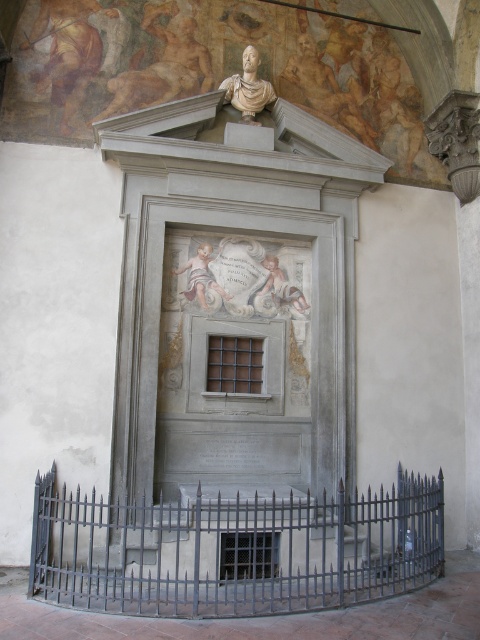
Question: Among these points, which one is farthest from the camera?

Choices:
 (A) (241, 97)
 (B) (44, 528)

Answer: (A)

Question: Which object appears farthest from the camera in this image?

Choices:
 (A) black metal fence at center
 (B) white marble bust at upper center
 (C) white marble plaque at center

Answer: (B)

Question: Can you confirm if white marble plaque at center is positioned to the left of white marble bust at upper center?

Choices:
 (A) yes
 (B) no

Answer: (A)

Question: Observing the image, what is the correct spatial positioning of black metal fence at center in reference to white marble bust at upper center?

Choices:
 (A) right
 (B) left

Answer: (A)

Question: Can you confirm if white marble plaque at center is wider than white marble bust at upper center?

Choices:
 (A) no
 (B) yes

Answer: (B)

Question: Which of the following is the farthest from the observer?

Choices:
 (A) white marble plaque at center
 (B) black metal fence at center
 (C) white marble bust at upper center

Answer: (C)